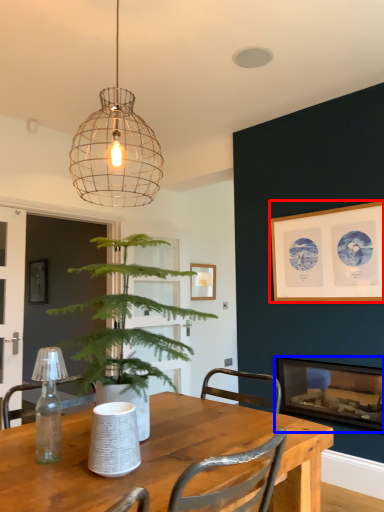
Question: Which of the following is the closest to the observer, picture frame (highlighted by a red box) or fireplace (highlighted by a blue box)?

Choices:
 (A) picture frame
 (B) fireplace

Answer: (A)